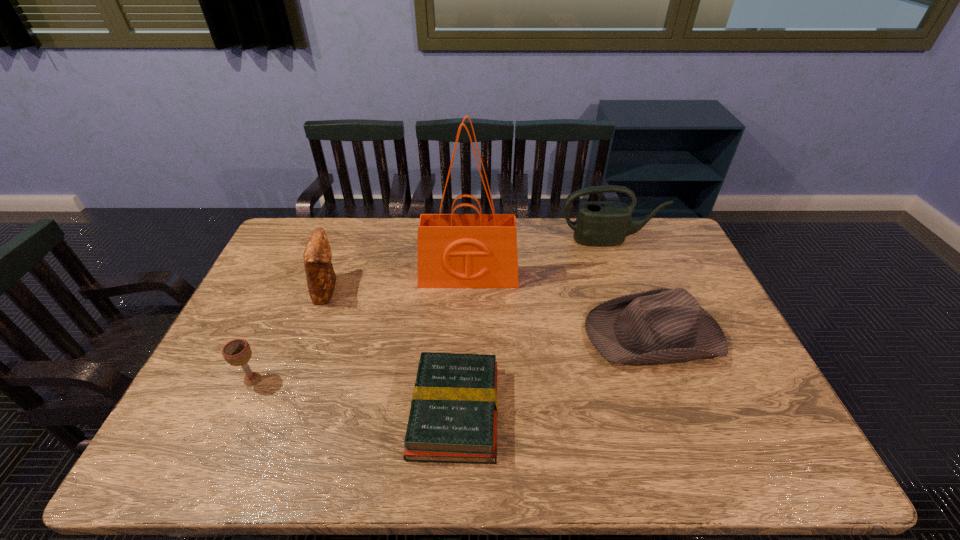
The image size is (960, 540). In order to click on free spot between the fedora and the tote bag in this screenshot , I will do `click(561, 305)`.

Where is `vacant area between the shortest object and the fedora`? vacant area between the shortest object and the fedora is located at coordinates (554, 372).

Identify which object is the second nearest to the fedora. Please provide its 2D coordinates. Your answer should be formatted as a tuple, i.e. [(x, y)], where the tuple contains the x and y coordinates of a point satisfying the conditions above.

[(453, 418)]

Locate which object is the third closest to the fedora. Please provide its 2D coordinates. Your answer should be formatted as a tuple, i.e. [(x, y)], where the tuple contains the x and y coordinates of a point satisfying the conditions above.

[(602, 223)]

Find the location of a particular element. The width and height of the screenshot is (960, 540). vacant area that satisfies the following two spatial constraints: 1. on the open side of the fourth shortest object; 2. on the right side of the shortest object is located at coordinates (282, 411).

This screenshot has width=960, height=540. In order to click on free point that satisfies the following two spatial constraints: 1. on the back side of the fedora; 2. on the open side of the clutch bag in this screenshot , I will do `click(636, 289)`.

Locate an element on the screen. The image size is (960, 540). vacant space that satisfies the following two spatial constraints: 1. on the back side of the shortest object; 2. on the open side of the fifth object from right to left is located at coordinates (461, 289).

Where is `vacant space that satisfies the following two spatial constraints: 1. on the logo side of the fedora; 2. on the right side of the tallest object`? The image size is (960, 540). vacant space that satisfies the following two spatial constraints: 1. on the logo side of the fedora; 2. on the right side of the tallest object is located at coordinates (467, 333).

Where is `free space that satisfies the following two spatial constraints: 1. on the spout of the watering can; 2. on the open side of the fourth shortest object`? This screenshot has height=540, width=960. free space that satisfies the following two spatial constraints: 1. on the spout of the watering can; 2. on the open side of the fourth shortest object is located at coordinates (627, 289).

At what (x,y) coordinates should I click in order to perform the action: click on free location that satisfies the following two spatial constraints: 1. on the spout of the fedora; 2. on the left side of the farthest object. Please return your answer as a coordinate pair (x, y). Looking at the image, I should click on (643, 333).